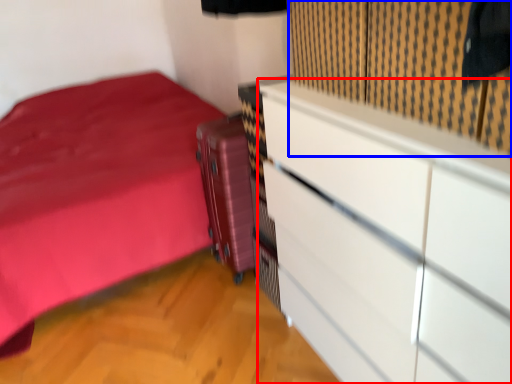
Question: Which point is closer to the camera, chest of drawers (highlighted by a red box) or curtain (highlighted by a blue box)?

Choices:
 (A) chest of drawers
 (B) curtain

Answer: (A)